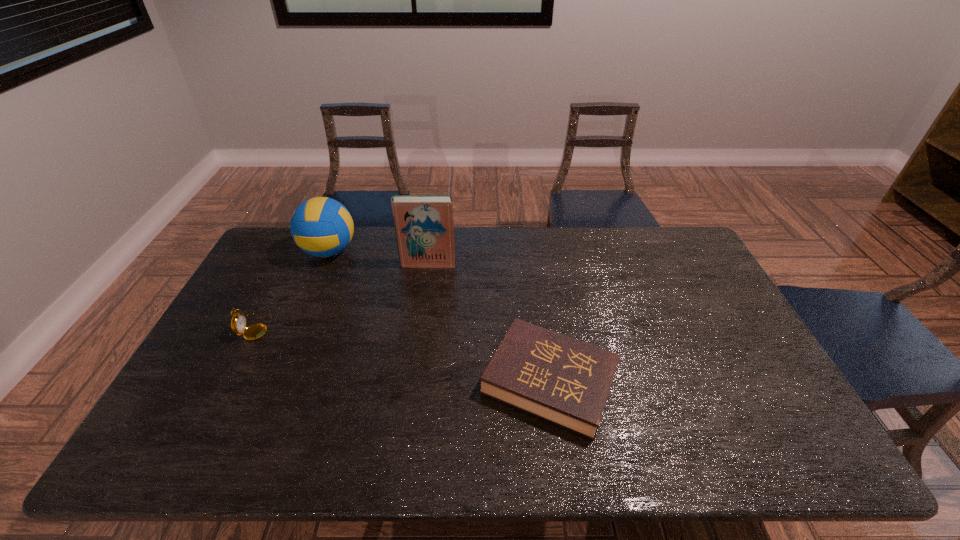
The height and width of the screenshot is (540, 960). Find the location of `the left hardback book`. the left hardback book is located at coordinates (424, 229).

The height and width of the screenshot is (540, 960). I want to click on the farther hardback book, so click(x=424, y=229).

This screenshot has width=960, height=540. Identify the location of the second tallest object. (322, 227).

Identify the location of pocket watch. The height and width of the screenshot is (540, 960). (238, 322).

Identify the location of the right hardback book. (565, 381).

The height and width of the screenshot is (540, 960). I want to click on the shorter hardback book, so click(565, 381).

Where is `free space located on the cover of the second object from right to left`? This screenshot has width=960, height=540. free space located on the cover of the second object from right to left is located at coordinates (415, 360).

Where is `vacant area situated 0.340m on the right of the volleyball`? vacant area situated 0.340m on the right of the volleyball is located at coordinates (453, 251).

The height and width of the screenshot is (540, 960). I want to click on vacant space located on the face of the pocket watch, so click(348, 327).

The image size is (960, 540). I want to click on vacant position located 0.400m on the right of the right hardback book, so click(773, 382).